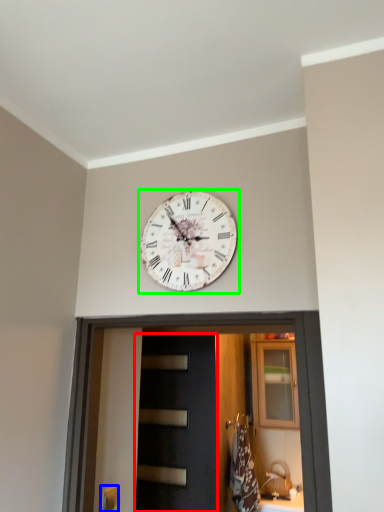
Question: Which object is positioned closest to door (highlighted by a red box)? Select from door handle (highlighted by a blue box) and wall clock (highlighted by a green box).

Choices:
 (A) door handle
 (B) wall clock

Answer: (A)